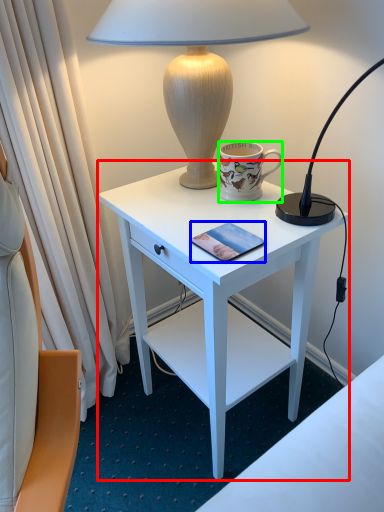
Question: Which is farther away from desk (highlighted by a red box)? pad (highlighted by a blue box) or coffee cup (highlighted by a green box)?

Choices:
 (A) pad
 (B) coffee cup

Answer: (A)